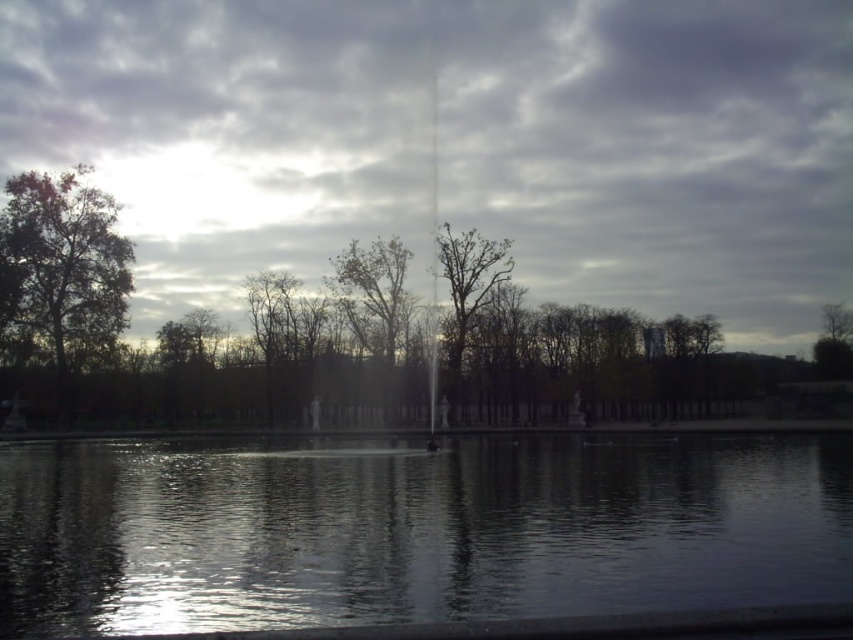
Question: Based on their relative distances, which object is nearer to the green leafy tree at left?

Choices:
 (A) gray cloudy sky at upper center
 (B) bare branches at center
 (C) transparent water at center
 (D) bare branches tree at center

Answer: (B)

Question: Which point appears closest to the camera in this image?

Choices:
 (A) (103, 228)
 (B) (454, 342)

Answer: (A)

Question: Does green leafy tree at left have a greater width compared to bare branches at center?

Choices:
 (A) no
 (B) yes

Answer: (B)

Question: Can you confirm if bare branches at center is smaller than bare branches tree at center?

Choices:
 (A) yes
 (B) no

Answer: (A)

Question: Is transparent water at center above green leafy tree at left?

Choices:
 (A) yes
 (B) no

Answer: (B)

Question: Which point appears closest to the camera in this image?

Choices:
 (A) (460, 248)
 (B) (757, 477)
 (C) (339, 294)

Answer: (B)